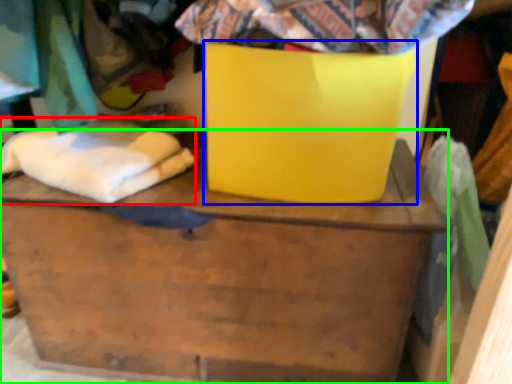
Question: Which object is the farthest from linen (highlighted by a red box)? Choose among these: cardboard box (highlighted by a blue box) or furniture (highlighted by a green box).

Choices:
 (A) cardboard box
 (B) furniture

Answer: (A)